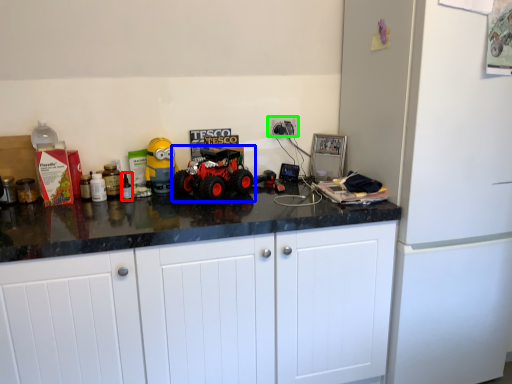
Question: Which object is the closest to the bottle (highlighted by a red box)? Choose among these: land vehicle (highlighted by a blue box) or electric outlet (highlighted by a green box).

Choices:
 (A) land vehicle
 (B) electric outlet

Answer: (A)